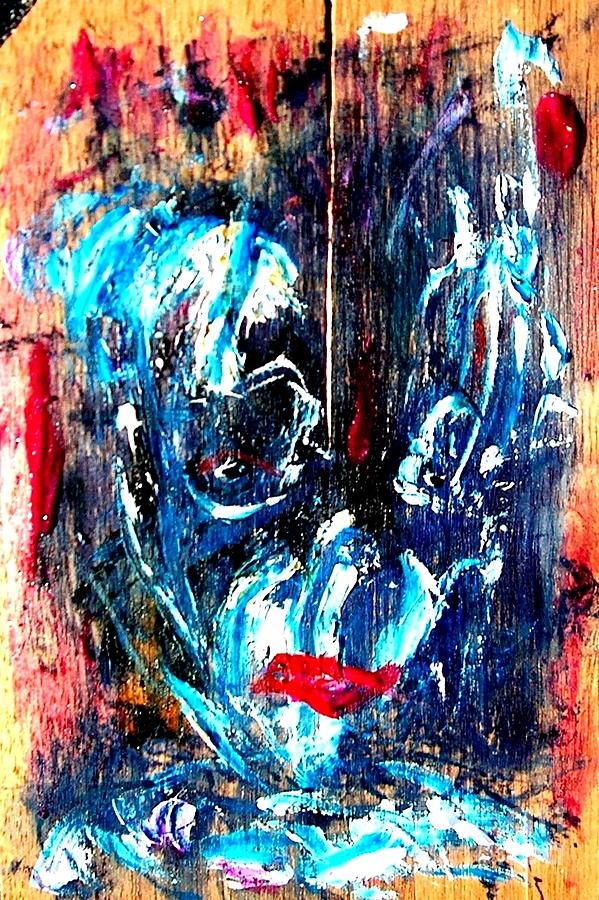
At what (x,y) coordinates should I click in order to perform the action: click on red paint. Please return your answer as a coordinate pair (x, y). The width and height of the screenshot is (599, 900). Looking at the image, I should click on (317, 688), (38, 445), (352, 438), (568, 130), (84, 74), (265, 94), (585, 546).